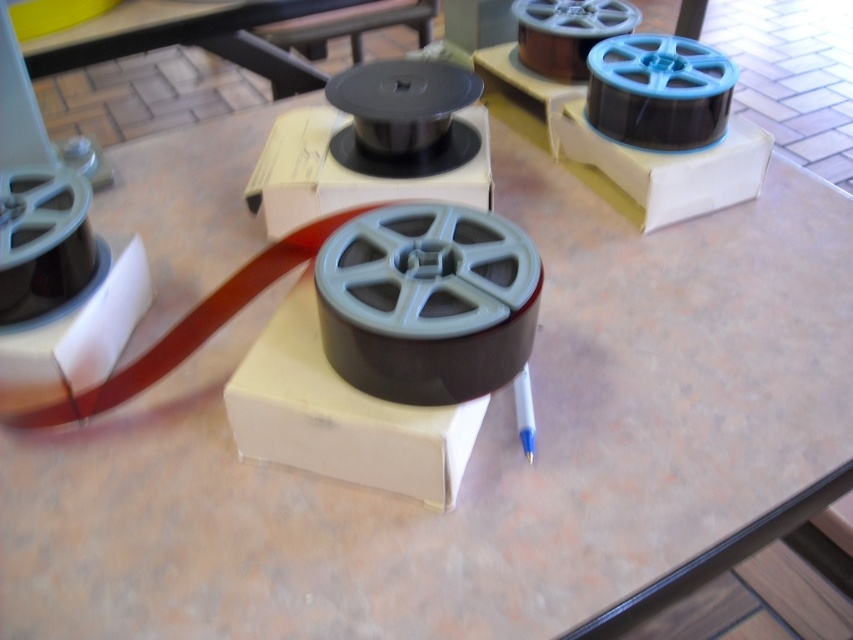
You are organizing film reels on a countertop. You need to place a new red film strip next to the gray matte film reel at center. Where should you place it so it doesn not interfere with the matte black film reel at upper center?

Since the gray matte film reel at center is to the left of the matte black film reel at upper center, you should place the new red film strip to the right of the gray matte film reel at center to avoid interference with the matte black film reel at upper center.

Based on the photo, you are a film archivist who needs to store these items in a storage box. The box has a width limit of 10 cm. You have two items to consider for storage today. The first is the matte black spool at center, and the second is the matte black film reel at upper center. Which item can fit into the box if the spool is 12 cm wide and the reel is 8 cm wide?

The matte black film reel at upper center can fit into the box since it is 8 cm wide, which is under the 10 cm limit. The matte black spool at center is 12 cm wide, exceeding the box width limit.